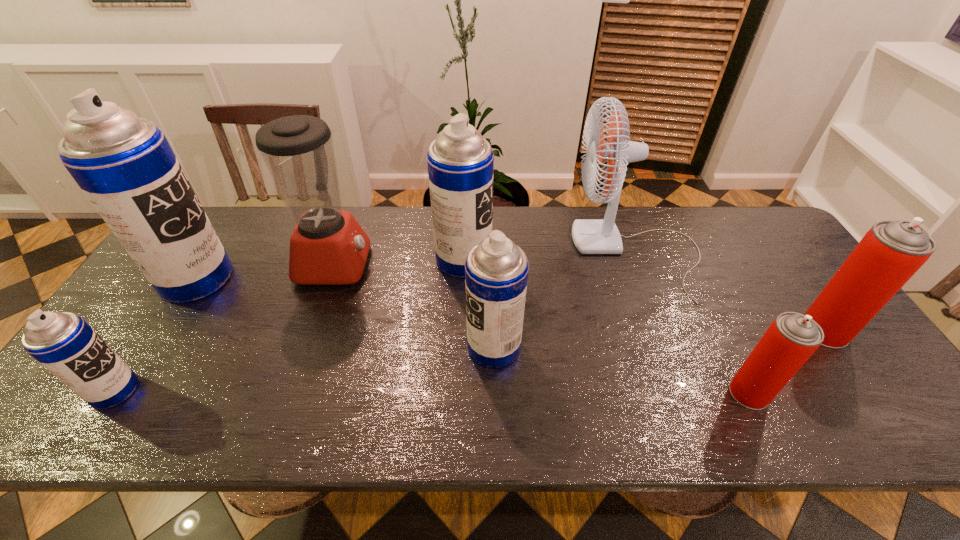
Find the location of a particular element. free location that satisfies the following two spatial constraints: 1. on the label side of the fifth shortest aerosol can; 2. on the right side of the rightmost object is located at coordinates (461, 330).

Where is `vacant space that satisfies the following two spatial constraints: 1. on the label side of the right red aerosol can; 2. on the right side of the third smallest blue aerosol can`? vacant space that satisfies the following two spatial constraints: 1. on the label side of the right red aerosol can; 2. on the right side of the third smallest blue aerosol can is located at coordinates (461, 330).

Where is `free spot that satisfies the following two spatial constraints: 1. on the back side of the rightmost object; 2. on the label side of the third smallest blue aerosol can`? The height and width of the screenshot is (540, 960). free spot that satisfies the following two spatial constraints: 1. on the back side of the rightmost object; 2. on the label side of the third smallest blue aerosol can is located at coordinates (775, 260).

Locate an element on the screen. The width and height of the screenshot is (960, 540). free location that satisfies the following two spatial constraints: 1. on the front of the blender near the controls; 2. on the left side of the nearer red aerosol can is located at coordinates (290, 393).

This screenshot has width=960, height=540. In order to click on free space in the image that satisfies the following two spatial constraints: 1. on the front-facing side of the left red aerosol can; 2. on the right side of the fan in this screenshot , I will do `click(690, 393)`.

At what (x,y) coordinates should I click in order to perform the action: click on free spot that satisfies the following two spatial constraints: 1. on the front-facing side of the fan; 2. on the back side of the right red aerosol can. Please return your answer as a coordinate pair (x, y). The image size is (960, 540). Looking at the image, I should click on (667, 330).